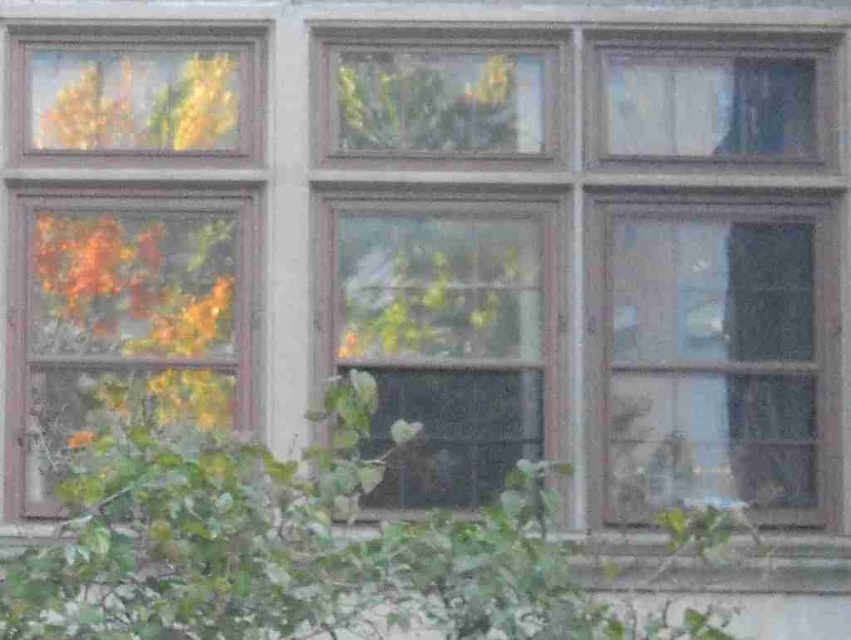
You are a window cleaner standing in front of the building. You need to clean both the transparent glass window at right and the clear glass window at center. Which window should you clean first if you want to avoid getting the lower window dirty while working on the upper one?

You should clean the transparent glass window at right first because it is in front of the clear glass window at center. If you clean the upper window first, water or cleaning solution might drip onto the lower window, so starting with the lower one prevents this issue.